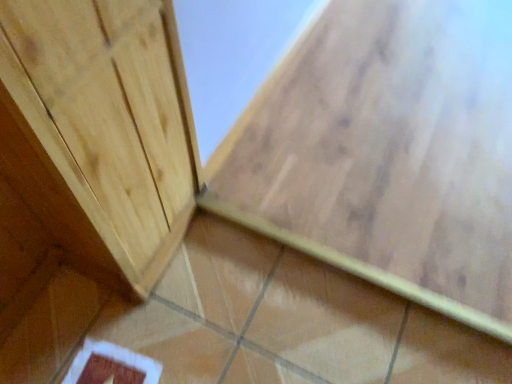
In order to face brown glossy tile at lower center, which is the first ceramic tile from bottom to top, should I rotate leftwards or rightwards?

To face it directly, rotate left by 1.310 degrees.

Find the location of `brown glossy tile at lower center, the second ceramic tile positioned from the top`. brown glossy tile at lower center, the second ceramic tile positioned from the top is located at coordinates (289, 321).

The width and height of the screenshot is (512, 384). Describe the element at coordinates (289, 321) in the screenshot. I see `brown glossy tile at lower center, the second ceramic tile positioned from the top` at that location.

What do you see at coordinates (385, 156) in the screenshot? This screenshot has height=384, width=512. I see `brown glossy tile at center, which is the second ceramic tile in bottom-to-top order` at bounding box center [385, 156].

Find the location of a particular element. This screenshot has height=384, width=512. brown glossy tile at center, which is the second ceramic tile in bottom-to-top order is located at coordinates (385, 156).

How much space does brown glossy tile at center, which is the 1th ceramic tile in top-to-bottom order, occupy horizontally?

It is 37.96 inches.

Find the location of a particular element. This screenshot has height=384, width=512. brown glossy tile at lower center, which is the first ceramic tile from bottom to top is located at coordinates 289,321.

Which is more to the right, brown glossy tile at lower center, which is the first ceramic tile from bottom to top, or brown glossy tile at center, which is the 1th ceramic tile in top-to-bottom order?

brown glossy tile at center, which is the 1th ceramic tile in top-to-bottom order.

Considering the positions of objects brown glossy tile at lower center, the second ceramic tile positioned from the top, and brown glossy tile at center, which is the 1th ceramic tile in top-to-bottom order, in the image provided, who is behind, brown glossy tile at lower center, the second ceramic tile positioned from the top, or brown glossy tile at center, which is the 1th ceramic tile in top-to-bottom order,?

brown glossy tile at center, which is the 1th ceramic tile in top-to-bottom order, is further from the camera.

Considering the positions of point (188, 338) and point (412, 90), is point (188, 338) closer or farther from the camera than point (412, 90)?

Point (188, 338) is closer to the camera than point (412, 90).

From the image's perspective, between brown glossy tile at lower center, the second ceramic tile positioned from the top, and brown glossy tile at center, which is the 1th ceramic tile in top-to-bottom order, which one is located above?

brown glossy tile at center, which is the 1th ceramic tile in top-to-bottom order, from the image's perspective.

From a real-world perspective, is brown glossy tile at lower center, which is the first ceramic tile from bottom to top, on brown glossy tile at center, which is the 1th ceramic tile in top-to-bottom order?

No, from a real-world perspective, brown glossy tile at lower center, which is the first ceramic tile from bottom to top, is not above brown glossy tile at center, which is the 1th ceramic tile in top-to-bottom order.

Based on the photo, which of these two, brown glossy tile at lower center, the second ceramic tile positioned from the top, or brown glossy tile at center, which is the second ceramic tile in bottom-to-top order, is thinner?

brown glossy tile at lower center, the second ceramic tile positioned from the top, is thinner.

Which of these two, brown glossy tile at lower center, which is the first ceramic tile from bottom to top, or brown glossy tile at center, which is the second ceramic tile in bottom-to-top order, stands shorter?

Answer: Standing shorter between the two is brown glossy tile at lower center, which is the first ceramic tile from bottom to top.

Can you confirm if brown glossy tile at lower center, the second ceramic tile positioned from the top, is bigger than brown glossy tile at center, which is the 1th ceramic tile in top-to-bottom order?

Actually, brown glossy tile at lower center, the second ceramic tile positioned from the top, might be smaller than brown glossy tile at center, which is the 1th ceramic tile in top-to-bottom order.

Is brown glossy tile at lower center, which is the first ceramic tile from bottom to top, not within brown glossy tile at center, which is the 1th ceramic tile in top-to-bottom order?

Yes, brown glossy tile at lower center, which is the first ceramic tile from bottom to top, is not within brown glossy tile at center, which is the 1th ceramic tile in top-to-bottom order.

Is brown glossy tile at lower center, the second ceramic tile positioned from the top, in contact with brown glossy tile at center, which is the 1th ceramic tile in top-to-bottom order?

No.

Is brown glossy tile at lower center, the second ceramic tile positioned from the top, turned away from brown glossy tile at center, which is the 1th ceramic tile in top-to-bottom order?

That's not correct — brown glossy tile at lower center, the second ceramic tile positioned from the top, is not looking away from brown glossy tile at center, which is the 1th ceramic tile in top-to-bottom order.

What's the angular difference between brown glossy tile at lower center, the second ceramic tile positioned from the top, and brown glossy tile at center, which is the second ceramic tile in bottom-to-top order,'s facing directions?

They differ by 90.5 degrees in their facing directions.

Measure the distance between brown glossy tile at lower center, which is the first ceramic tile from bottom to top, and brown glossy tile at center, which is the second ceramic tile in bottom-to-top order.

brown glossy tile at lower center, which is the first ceramic tile from bottom to top, and brown glossy tile at center, which is the second ceramic tile in bottom-to-top order, are 15.09 inches apart from each other.

Locate an element on the screen. Image resolution: width=512 pixels, height=384 pixels. ceramic tile on the right of brown glossy tile at lower center, the second ceramic tile positioned from the top is located at coordinates (385, 156).

Considering the relative positions of brown glossy tile at center, which is the second ceramic tile in bottom-to-top order, and brown glossy tile at lower center, which is the first ceramic tile from bottom to top, in the image provided, is brown glossy tile at center, which is the second ceramic tile in bottom-to-top order, to the right of brown glossy tile at lower center, which is the first ceramic tile from bottom to top, from the viewer's perspective?

Yes.

Is brown glossy tile at center, which is the 1th ceramic tile in top-to-bottom order, positioned behind brown glossy tile at lower center, which is the first ceramic tile from bottom to top?

Yes, it is.

Does point (380, 250) come in front of point (395, 363)?

No, it is behind (395, 363).

From the image's perspective, is brown glossy tile at center, which is the second ceramic tile in bottom-to-top order, on top of brown glossy tile at lower center, the second ceramic tile positioned from the top?

Yes, from the image's perspective, brown glossy tile at center, which is the second ceramic tile in bottom-to-top order, is over brown glossy tile at lower center, the second ceramic tile positioned from the top.

From a real-world perspective, between brown glossy tile at center, which is the 1th ceramic tile in top-to-bottom order, and brown glossy tile at lower center, which is the first ceramic tile from bottom to top, who is vertically lower?

brown glossy tile at lower center, which is the first ceramic tile from bottom to top, is physically lower.

Considering the sizes of objects brown glossy tile at center, which is the second ceramic tile in bottom-to-top order, and brown glossy tile at lower center, which is the first ceramic tile from bottom to top, in the image provided, who is thinner, brown glossy tile at center, which is the second ceramic tile in bottom-to-top order, or brown glossy tile at lower center, which is the first ceramic tile from bottom to top,?

With smaller width is brown glossy tile at lower center, which is the first ceramic tile from bottom to top.

Does brown glossy tile at center, which is the second ceramic tile in bottom-to-top order, have a greater height compared to brown glossy tile at lower center, which is the first ceramic tile from bottom to top?

Yes.

Between brown glossy tile at center, which is the second ceramic tile in bottom-to-top order, and brown glossy tile at lower center, which is the first ceramic tile from bottom to top, which one has smaller size?

brown glossy tile at lower center, which is the first ceramic tile from bottom to top, is smaller.

Is brown glossy tile at lower center, which is the first ceramic tile from bottom to top, located within brown glossy tile at center, which is the second ceramic tile in bottom-to-top order?

No, brown glossy tile at lower center, which is the first ceramic tile from bottom to top, is not inside brown glossy tile at center, which is the second ceramic tile in bottom-to-top order.

Are brown glossy tile at center, which is the second ceramic tile in bottom-to-top order, and brown glossy tile at lower center, the second ceramic tile positioned from the top, far apart?

They are positioned close to each other.

Could you tell me if brown glossy tile at center, which is the 1th ceramic tile in top-to-bottom order, is facing brown glossy tile at lower center, the second ceramic tile positioned from the top?

No, brown glossy tile at center, which is the 1th ceramic tile in top-to-bottom order, is not oriented towards brown glossy tile at lower center, the second ceramic tile positioned from the top.

How many degrees apart are the facing directions of brown glossy tile at center, which is the 1th ceramic tile in top-to-bottom order, and brown glossy tile at lower center, which is the first ceramic tile from bottom to top?

They differ by 90.5 degrees in their facing directions.

Locate an element on the screen. Image resolution: width=512 pixels, height=384 pixels. ceramic tile below the brown glossy tile at center, which is the second ceramic tile in bottom-to-top order (from the image's perspective) is located at coordinates (289, 321).

The image size is (512, 384). I want to click on ceramic tile located on the right of brown glossy tile at lower center, which is the first ceramic tile from bottom to top, so click(385, 156).

Identify the location of ceramic tile that is below the brown glossy tile at center, which is the 1th ceramic tile in top-to-bottom order (from the image's perspective). (289, 321).